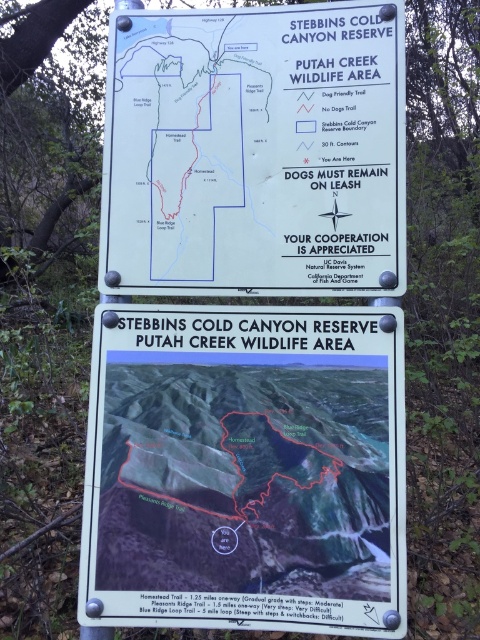
You are a hiker trying to read both the white plastic sign at center and the white paper sign at upper center. Which sign do you need to step closer to in order to read the details clearly?

The white paper sign at upper center has a smaller width compared to the white plastic sign at center, so you would need to step closer to the white paper sign at upper center to read its details clearly.

You are a hiker trying to read both the white plastic sign at center and the white paper sign at upper center. Which sign should you look up to see first?

The white paper sign at upper center is located above the white plastic sign at center, so you should look up to see the white paper sign at upper center first.